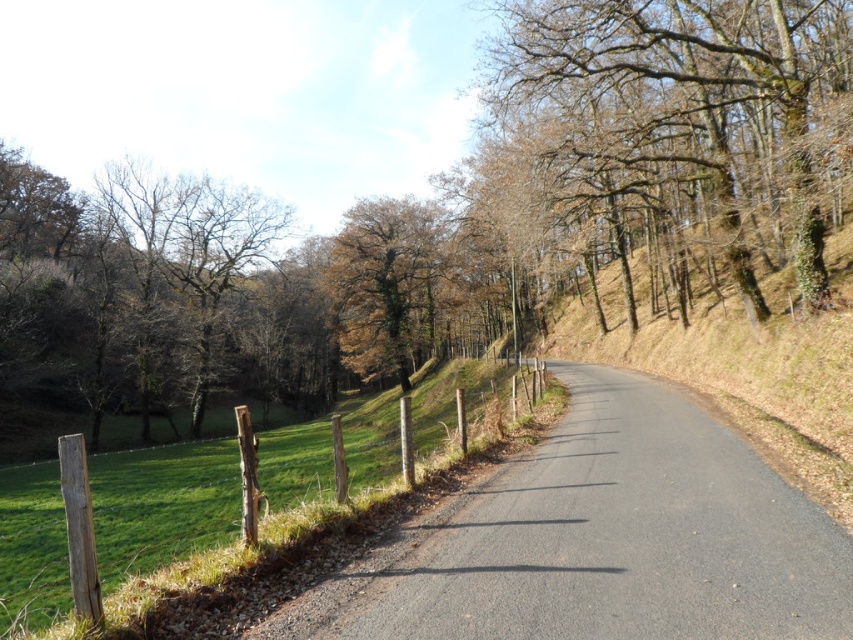
Question: From the image, what is the correct spatial relationship of brown leafy tree at center in relation to brown leafless tree at upper right?

Choices:
 (A) right
 (B) left

Answer: (B)

Question: Does brown leafy tree at center appear over asphalt road at center?

Choices:
 (A) yes
 (B) no

Answer: (A)

Question: Is asphalt road at center to the right of brown leafless tree at upper right from the viewer's perspective?

Choices:
 (A) no
 (B) yes

Answer: (A)

Question: Among these objects, which one is farthest from the camera?

Choices:
 (A) brown rough tree at center
 (B) asphalt road at center

Answer: (A)

Question: Which point appears closest to the camera in this image?

Choices:
 (A) (378, 209)
 (B) (708, 22)

Answer: (B)

Question: Which object is positioned farthest from the brown leafy tree at center?

Choices:
 (A) brown leafless tree at upper right
 (B) weathered wood fence at lower left

Answer: (B)